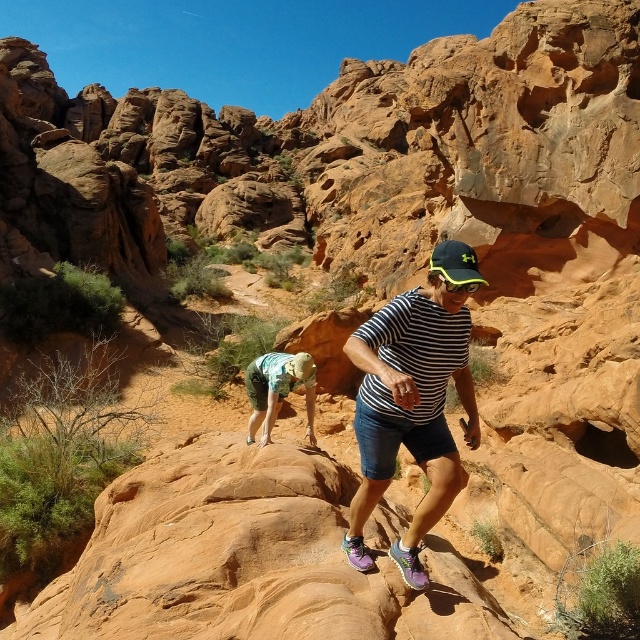
Question: Which point is farther to the camera?

Choices:
 (A) black matte baseball cap at center
 (B) green camouflage shorts at center
 (C) striped cotton shirt at center

Answer: (B)

Question: Can you confirm if green camouflage shorts at center is positioned below black matte baseball cap at center?

Choices:
 (A) no
 (B) yes

Answer: (B)

Question: Can you confirm if striped cotton shirt at center is smaller than green camouflage shorts at center?

Choices:
 (A) no
 (B) yes

Answer: (A)

Question: Which point appears farthest from the camera in this image?

Choices:
 (A) (452, 241)
 (B) (307, 403)

Answer: (A)

Question: Can you confirm if striped cotton shirt at center is positioned to the right of green camouflage shorts at center?

Choices:
 (A) yes
 (B) no

Answer: (A)

Question: Which point is closer to the camera?

Choices:
 (A) (452, 253)
 (B) (476, 282)

Answer: (B)